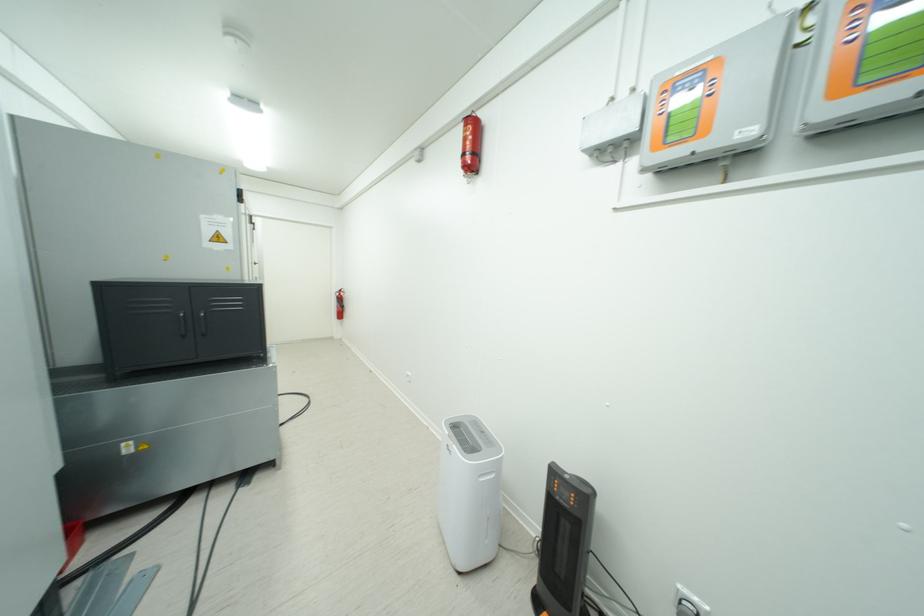
Where would you pull the fire extinguisher handle? Please return your answer as a coordinate pair (x, y).

(470, 146)